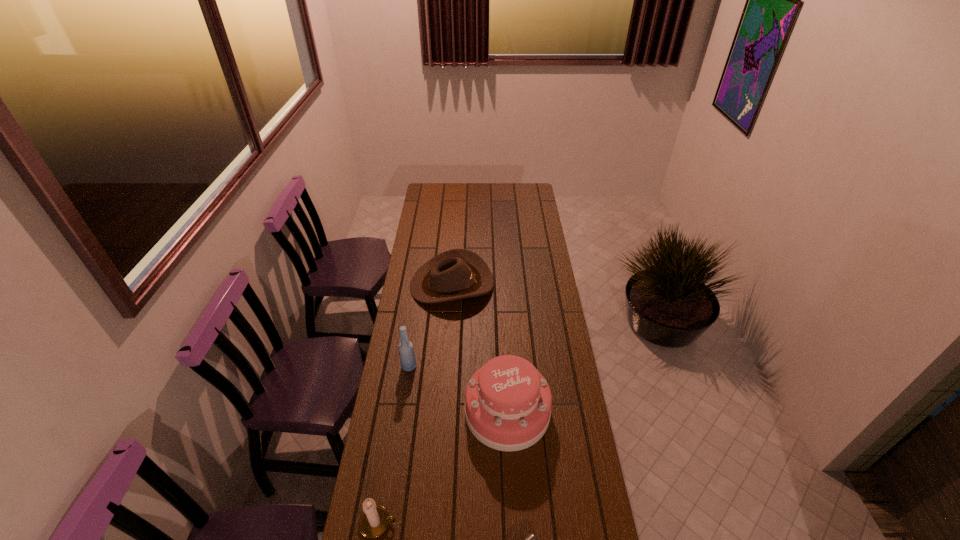
Identify the location of vacant space in between the third farthest object and the candle holder. (443, 468).

At what (x,y) coordinates should I click in order to perform the action: click on vacant space in between the candle holder and the birthday cake. Please return your answer as a coordinate pair (x, y). Image resolution: width=960 pixels, height=540 pixels. Looking at the image, I should click on click(443, 468).

Where is `free point between the bottle and the candle holder`? This screenshot has height=540, width=960. free point between the bottle and the candle holder is located at coordinates (394, 444).

Locate which object is the closest to the shortest object. Please provide its 2D coordinates. Your answer should be formatted as a tuple, i.e. [(x, y)], where the tuple contains the x and y coordinates of a point satisfying the conditions above.

[(508, 402)]

Choose which object is the fourth nearest neighbor to the bottle. Please provide its 2D coordinates. Your answer should be formatted as a tuple, i.e. [(x, y)], where the tuple contains the x and y coordinates of a point satisfying the conditions above.

[(531, 539)]

Locate an element on the screen. The width and height of the screenshot is (960, 540). free space that satisfies the following two spatial constraints: 1. on the front side of the bottle; 2. on the handle side of the candle holder is located at coordinates (386, 523).

I want to click on blank space that satisfies the following two spatial constraints: 1. on the front side of the bottle; 2. on the left side of the birthday cake, so click(x=402, y=412).

Where is `vacant space that satisfies the following two spatial constraints: 1. on the front side of the third farthest object; 2. on the handle side of the candle holder`? The height and width of the screenshot is (540, 960). vacant space that satisfies the following two spatial constraints: 1. on the front side of the third farthest object; 2. on the handle side of the candle holder is located at coordinates (513, 523).

In order to click on free space that satisfies the following two spatial constraints: 1. with a star on the front of the birthday cake; 2. on the right side of the cowboy hat in this screenshot , I will do `click(443, 412)`.